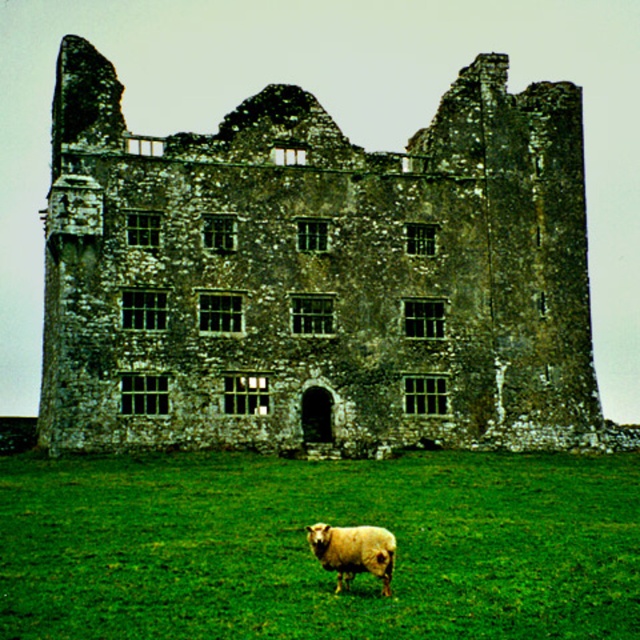
You are a tourist standing in front of the ancient stone castle. You see the green grass at lower center and the white woolly sheep at lower center. Which object is higher in the image?

The green grass at lower center is above the white woolly sheep at lower center, so the green grass at lower center is higher in the image.

You are standing in front of the ancient stone castle and want to take a photo. You notice two points marked in the scene. The first point is at coordinate point (x=566, y=100) and the second is at point (x=264, y=586). Which point is closer to your camera?

Point (x=566, y=100) is further to the camera than point (x=264, y=586), so the point closer to your camera is point (x=264, y=586).

You are standing in the field near the white woolly sheep at lower center and want to walk to the rusty stone castle at center. Which direction should you move to get closer to the castle?

You should move away from the viewer since the rusty stone castle at center is further away than the white woolly sheep at lower center, which is closer to you.